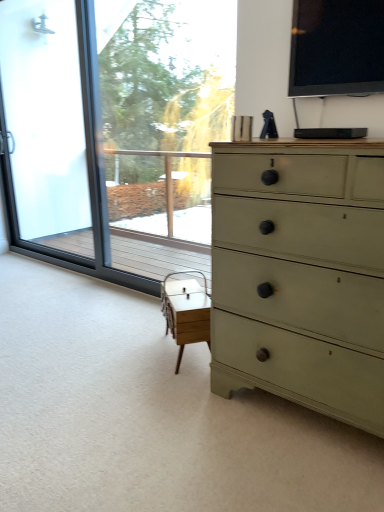
Question: Would you say frosted glass screen door at left is a long distance from transparent glass window at left, the 1th window screen from the back?

Choices:
 (A) yes
 (B) no

Answer: (B)

Question: From the image's perspective, is frosted glass screen door at left under transparent glass window at left, which appears as the 1th window screen when viewed from the left?

Choices:
 (A) yes
 (B) no

Answer: (B)

Question: Can you confirm if frosted glass screen door at left is smaller than transparent glass window at left, which is the 2th window screen in right-to-left order?

Choices:
 (A) yes
 (B) no

Answer: (A)

Question: Does frosted glass screen door at left have a greater width compared to transparent glass window at left, which is the 2th window screen in right-to-left order?

Choices:
 (A) no
 (B) yes

Answer: (A)

Question: Could you tell me if frosted glass screen door at left is facing transparent glass window at left, which is the 2th window screen in right-to-left order?

Choices:
 (A) no
 (B) yes

Answer: (A)

Question: Visually, is transparent glass window at left, the second window screen viewed from the front, positioned to the left or to the right of matte green dresser at right?

Choices:
 (A) right
 (B) left

Answer: (B)

Question: Which is correct: transparent glass window at left, the 1th window screen from the back, is inside matte green dresser at right, or outside of it?

Choices:
 (A) outside
 (B) inside

Answer: (A)

Question: From a real-world perspective, is transparent glass window at left, which is the 2th window screen in right-to-left order, positioned above or below matte green dresser at right?

Choices:
 (A) above
 (B) below

Answer: (A)

Question: Is point (193, 157) positioned closer to the camera than point (240, 327)?

Choices:
 (A) farther
 (B) closer

Answer: (A)

Question: Is black glossy tv at upper right, positioned as the second window screen in back-to-front order, inside or outside of frosted glass screen door at left?

Choices:
 (A) inside
 (B) outside

Answer: (B)

Question: Considering the positions of black glossy tv at upper right, the first window screen positioned from the right, and frosted glass screen door at left in the image, is black glossy tv at upper right, the first window screen positioned from the right, bigger or smaller than frosted glass screen door at left?

Choices:
 (A) big
 (B) small

Answer: (B)

Question: Considering the positions of point (350, 47) and point (21, 195), is point (350, 47) closer or farther from the camera than point (21, 195)?

Choices:
 (A) farther
 (B) closer

Answer: (B)

Question: From a real-world perspective, is black glossy tv at upper right, the first window screen in the front-to-back sequence, physically located above or below frosted glass screen door at left?

Choices:
 (A) below
 (B) above

Answer: (B)

Question: Looking at their shapes, would you say white wood table at center is wider or thinner than black glossy tv at upper right, positioned as the second window screen in back-to-front order?

Choices:
 (A) thin
 (B) wide

Answer: (B)

Question: Visually, is white wood table at center positioned to the left or to the right of black glossy tv at upper right, the first window screen in the front-to-back sequence?

Choices:
 (A) left
 (B) right

Answer: (A)